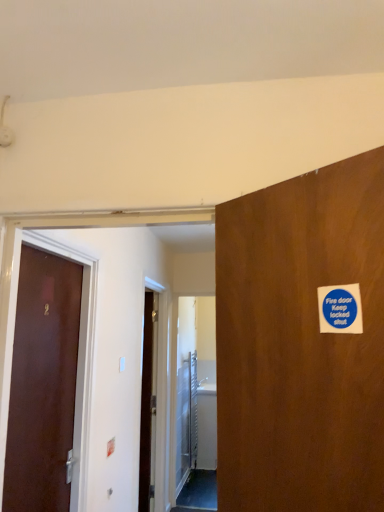
Question: Is brown matte door at left further to camera compared to metallic silver elevator door at center?

Choices:
 (A) yes
 (B) no

Answer: (B)

Question: Does brown matte door at left have a lesser width compared to metallic silver elevator door at center?

Choices:
 (A) no
 (B) yes

Answer: (B)

Question: Is brown matte door at left positioned in front of metallic silver elevator door at center?

Choices:
 (A) yes
 (B) no

Answer: (A)

Question: Is brown matte door at left at the left side of metallic silver elevator door at center?

Choices:
 (A) yes
 (B) no

Answer: (A)

Question: Are brown matte door at left and metallic silver elevator door at center making contact?

Choices:
 (A) no
 (B) yes

Answer: (A)

Question: From the image's perspective, is brown matte door at left on top of metallic silver elevator door at center?

Choices:
 (A) no
 (B) yes

Answer: (B)

Question: Is blue paper sticker at upper right to the left of brown matte door at left from the viewer's perspective?

Choices:
 (A) no
 (B) yes

Answer: (A)

Question: Considering the relative sizes of blue paper sticker at upper right and brown matte door at left in the image provided, is blue paper sticker at upper right thinner than brown matte door at left?

Choices:
 (A) no
 (B) yes

Answer: (B)

Question: Is blue paper sticker at upper right facing away from brown matte door at left?

Choices:
 (A) no
 (B) yes

Answer: (A)

Question: Is blue paper sticker at upper right wider than brown matte door at left?

Choices:
 (A) yes
 (B) no

Answer: (B)

Question: Can brown matte door at left be found inside blue paper sticker at upper right?

Choices:
 (A) no
 (B) yes

Answer: (A)

Question: Would you say blue paper sticker at upper right is a long distance from brown matte door at left?

Choices:
 (A) yes
 (B) no

Answer: (A)

Question: Is there a large distance between blue paper sticker at upper right and metallic silver elevator door at center?

Choices:
 (A) yes
 (B) no

Answer: (A)